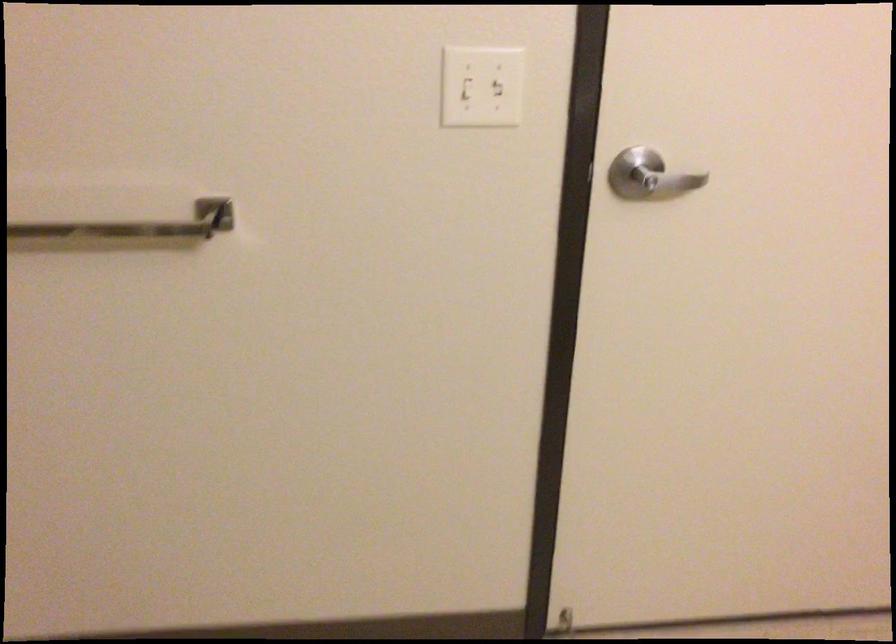
This screenshot has width=896, height=644. What are the coordinates of `metal grab bar` in the screenshot? It's located at (125, 219).